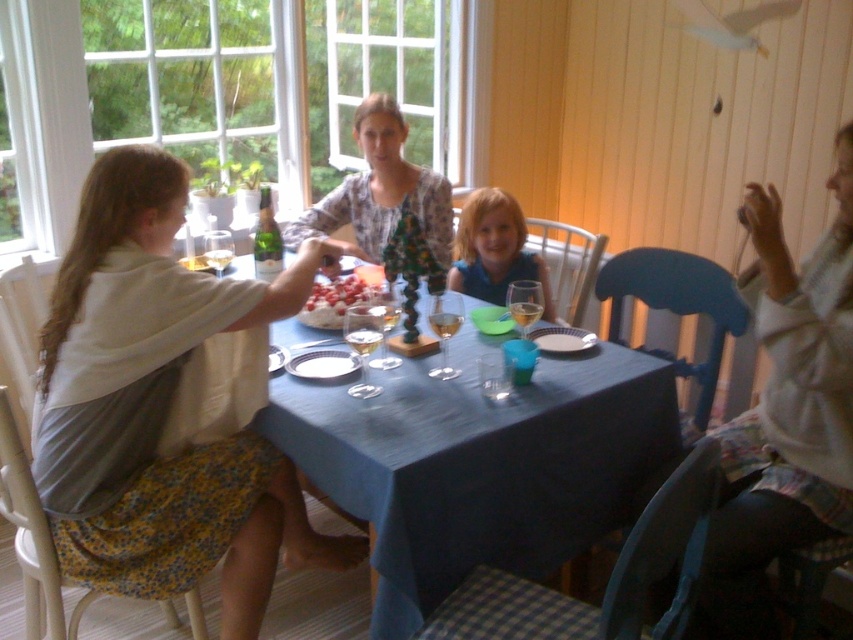
Does point (141, 276) lie in front of point (306, 314)?

That is True.

Does matte white blouse at upper left have a greater height compared to white fluffy cake at center?

Indeed, matte white blouse at upper left has a greater height compared to white fluffy cake at center.

Which is behind, point (260, 314) or point (360, 282)?

Point (360, 282)

You are a GUI agent. You are given a task and a screenshot of the screen. Output one action in this format:
    pyautogui.click(x=<x>, y=<y>)
    Task: Click on the matte white blouse at upper left
    
    Given the screenshot: What is the action you would take?
    pyautogui.click(x=160, y=406)

Is point (381, 134) farther from viewer compared to point (544, 282)?

Yes, it is.

Identify the location of floral print blouse at center. The width and height of the screenshot is (853, 640). coord(380,192).

Describe the element at coordinates (380, 192) in the screenshot. The image size is (853, 640). I see `floral print blouse at center` at that location.

Where is `floral print blouse at center`? Image resolution: width=853 pixels, height=640 pixels. floral print blouse at center is located at coordinates (380, 192).

This screenshot has width=853, height=640. What are the coordinates of `blue fabric table at center` in the screenshot? It's located at (479, 464).

Can you confirm if blue fabric table at center is positioned above white fluffy cake at center?

No, blue fabric table at center is not above white fluffy cake at center.

Does point (410, 616) come closer to viewer compared to point (343, 291)?

Yes, point (410, 616) is closer to viewer.

I want to click on blue fabric table at center, so click(x=479, y=464).